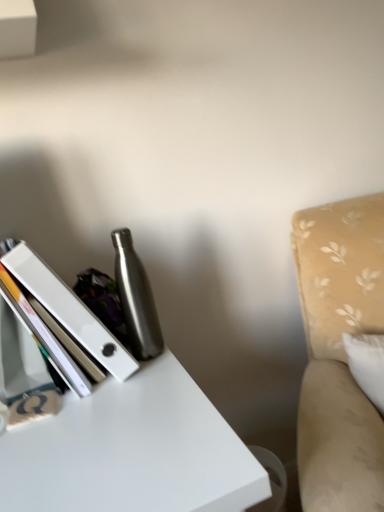
Question: Does white glossy book at left appear on the right side of beige fabric swivel chair at right?

Choices:
 (A) no
 (B) yes

Answer: (A)

Question: Does white glossy book at left have a lesser width compared to beige fabric swivel chair at right?

Choices:
 (A) no
 (B) yes

Answer: (B)

Question: Is white glossy book at left positioned behind beige fabric swivel chair at right?

Choices:
 (A) no
 (B) yes

Answer: (B)

Question: Is white glossy book at left oriented towards beige fabric swivel chair at right?

Choices:
 (A) yes
 (B) no

Answer: (B)

Question: Is white glossy book at left completely or partially outside of beige fabric swivel chair at right?

Choices:
 (A) yes
 (B) no

Answer: (A)

Question: Considering the positions of point (122, 375) and point (147, 336), is point (122, 375) closer or farther from the camera than point (147, 336)?

Choices:
 (A) farther
 (B) closer

Answer: (B)

Question: Is white glossy book at left inside or outside of brushed metal water bottle at center?

Choices:
 (A) outside
 (B) inside

Answer: (A)

Question: Looking at the image, does white glossy book at left seem bigger or smaller compared to brushed metal water bottle at center?

Choices:
 (A) small
 (B) big

Answer: (B)

Question: Is white glossy book at left in front of or behind brushed metal water bottle at center in the image?

Choices:
 (A) behind
 (B) front

Answer: (B)

Question: From their relative heights in the image, would you say beige fabric swivel chair at right is taller or shorter than white glossy book at left?

Choices:
 (A) short
 (B) tall

Answer: (B)

Question: Does point (317, 238) appear closer or farther from the camera than point (59, 327)?

Choices:
 (A) closer
 (B) farther

Answer: (B)

Question: Relative to white glossy book at left, is beige fabric swivel chair at right in front or behind?

Choices:
 (A) behind
 (B) front

Answer: (B)

Question: Is beige fabric swivel chair at right inside or outside of white glossy book at left?

Choices:
 (A) outside
 (B) inside

Answer: (A)

Question: Considering the positions of brushed metal water bottle at center and white glossy book at left in the image, is brushed metal water bottle at center wider or thinner than white glossy book at left?

Choices:
 (A) wide
 (B) thin

Answer: (B)

Question: Is brushed metal water bottle at center in front of or behind white glossy book at left in the image?

Choices:
 (A) front
 (B) behind

Answer: (B)